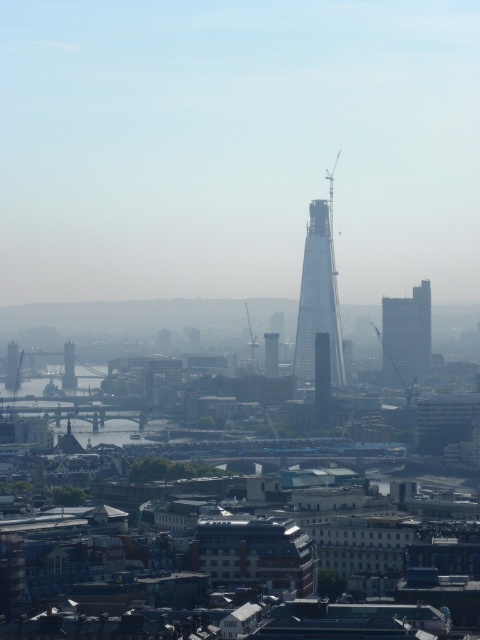
Is point (309, 276) positioned behind point (68, 376)?

No, (309, 276) is closer to viewer.

What do you see at coordinates (317, 298) in the screenshot? Image resolution: width=480 pixels, height=640 pixels. I see `transparent glass tower at center` at bounding box center [317, 298].

Find the location of a particular element. The width and height of the screenshot is (480, 640). transparent glass tower at center is located at coordinates (317, 298).

Find the location of a particular element. The height and width of the screenshot is (640, 480). transparent glass tower at center is located at coordinates (317, 298).

Does point (411, 304) lie behind point (68, 346)?

Yes, it is.

Which is more to the right, matte gray building at right or silver metallic bridge at left?

matte gray building at right

Between point (428, 337) and point (71, 356), which one is positioned in front?

Point (71, 356)

Where is `matte gray building at right`? The image size is (480, 640). matte gray building at right is located at coordinates (407, 336).

Is the position of transparent glass tower at center more distant than that of glass skyscraper at center?

No.

Can you confirm if transparent glass tower at center is positioned below glass skyscraper at center?

Actually, transparent glass tower at center is above glass skyscraper at center.

Between point (324, 243) and point (268, 337), which one is positioned in front?

Point (268, 337) is more forward.

Locate an element on the screen. Image resolution: width=480 pixels, height=640 pixels. transparent glass tower at center is located at coordinates (317, 298).